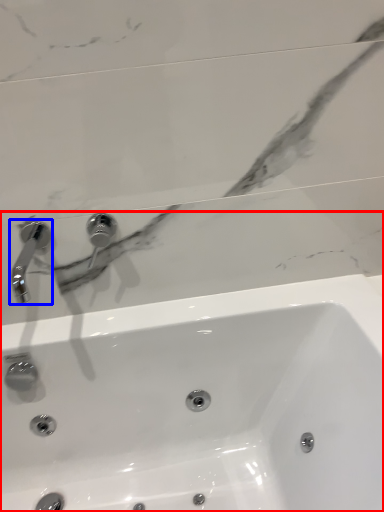
Question: Which point is closer to the camera, sink (highlighted by a red box) or tap (highlighted by a blue box)?

Choices:
 (A) sink
 (B) tap

Answer: (A)